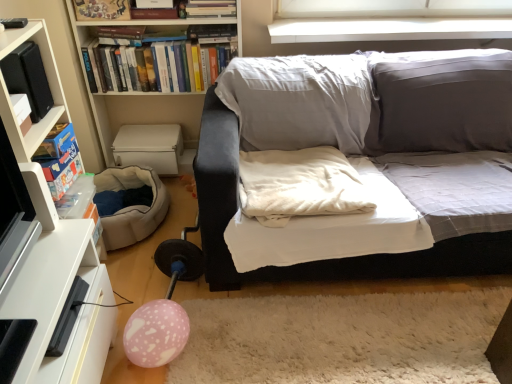
The height and width of the screenshot is (384, 512). I want to click on white glossy cabinet at left, the second cabinetry in the back-to-front sequence, so click(x=44, y=253).

Image resolution: width=512 pixels, height=384 pixels. Describe the element at coordinates (60, 159) in the screenshot. I see `blue cardboard game box at left, which is the 3th paperback book in top-to-bottom order` at that location.

Describe the element at coordinates (22, 111) in the screenshot. I see `white matte paperback book at upper left, the second paperback book viewed from the top` at that location.

Identify the location of white glossy cabinet at left, arranged as the first cabinetry when viewed from the front. The height and width of the screenshot is (384, 512). (44, 253).

Which is correct: white glossy tv stand at lower left is inside beige fabric bean bag at lower left, or outside of it?

white glossy tv stand at lower left is outside beige fabric bean bag at lower left.

Considering the sizes of objects white glossy tv stand at lower left and beige fabric bean bag at lower left in the image provided, who is smaller, white glossy tv stand at lower left or beige fabric bean bag at lower left?

beige fabric bean bag at lower left.

From the image's perspective, is white glossy tv stand at lower left located beneath beige fabric bean bag at lower left?

Yes.

From a real-world perspective, count 3rd paperback books upward from the white fabric couch at center and point to it. Please provide its 2D coordinates.

[(28, 78)]

Would you say white fabric couch at center is part of black matte speaker at left, positioned as the first paperback book in top-to-bottom order,'s contents?

Definitely not — white fabric couch at center is not inside black matte speaker at left, positioned as the first paperback book in top-to-bottom order.

From the image's perspective, would you say black matte speaker at left, the third paperback book in the bottom-to-top sequence, is shown under white fabric couch at center?

No, from the image's perspective, black matte speaker at left, the third paperback book in the bottom-to-top sequence, is not below white fabric couch at center.

Between point (40, 118) and point (463, 86), which one is positioned behind?

The point (463, 86) is farther.

Considering the sizes of objects white glossy cabinet at left, arranged as the first cabinetry when viewed from the front, and blue cardboard game box at left, marked as the 1th paperback book in a bottom-to-top arrangement, in the image provided, who is shorter, white glossy cabinet at left, arranged as the first cabinetry when viewed from the front, or blue cardboard game box at left, marked as the 1th paperback book in a bottom-to-top arrangement,?

Standing shorter between the two is blue cardboard game box at left, marked as the 1th paperback book in a bottom-to-top arrangement.

From a real-world perspective, which object stands above the other?

In real-world perspective, blue cardboard game box at left, which is the 3th paperback book in top-to-bottom order, is above.

Is white glossy cabinet at left, the second cabinetry in the back-to-front sequence, turned away from blue cardboard game box at left, which is the 3th paperback book in top-to-bottom order?

Absolutely, white glossy cabinet at left, the second cabinetry in the back-to-front sequence, is directed away from blue cardboard game box at left, which is the 3th paperback book in top-to-bottom order.

Considering the relative sizes of white glossy cabinet at left, arranged as the first cabinetry when viewed from the front, and blue cardboard game box at left, which is the 3th paperback book in top-to-bottom order, in the image provided, is white glossy cabinet at left, arranged as the first cabinetry when viewed from the front, smaller than blue cardboard game box at left, which is the 3th paperback book in top-to-bottom order,?

No.

Is pink matte balloon at lower left taller or shorter than white matte paperback book at upper left, the second paperback book from the bottom?

Clearly, pink matte balloon at lower left is taller compared to white matte paperback book at upper left, the second paperback book from the bottom.

In terms of width, does pink matte balloon at lower left look wider or thinner when compared to white matte paperback book at upper left, the second paperback book viewed from the top?

pink matte balloon at lower left is wider than white matte paperback book at upper left, the second paperback book viewed from the top.

Is pink matte balloon at lower left next to white matte paperback book at upper left, the second paperback book from the bottom?

There is a gap between pink matte balloon at lower left and white matte paperback book at upper left, the second paperback book from the bottom.

Does point (132, 325) lie behind point (17, 115)?

Yes, point (132, 325) is behind point (17, 115).

Looking at this image, is black matte speaker at left, positioned as the first paperback book in top-to-bottom order, next to matte wooden frame at upper left, which is the first book in front-to-back order, and touching it?

No, black matte speaker at left, positioned as the first paperback book in top-to-bottom order, is not beside matte wooden frame at upper left, which is the first book in front-to-back order.

From the black matte speaker at left, the third paperback book in the bottom-to-top sequence, count 1st books backward and point to it. Please provide its 2D coordinates.

[(102, 10)]

Considering the relative sizes of black matte speaker at left, positioned as the first paperback book in top-to-bottom order, and matte wooden frame at upper left, which is the first book in front-to-back order, in the image provided, is black matte speaker at left, positioned as the first paperback book in top-to-bottom order, wider than matte wooden frame at upper left, which is the first book in front-to-back order,?

Yes.

Would you say black matte speaker at left, the third paperback book in the bottom-to-top sequence, is outside matte wooden frame at upper left, which is the first book in front-to-back order?

Yes.

Can you confirm if white fluffy rug at lower center is taller than matte wooden frame at upper left, which is the 2th book from back to front?

Incorrect, the height of white fluffy rug at lower center is not larger of that of matte wooden frame at upper left, which is the 2th book from back to front.

Considering the relative sizes of white fluffy rug at lower center and matte wooden frame at upper left, which is the 2th book from back to front, in the image provided, is white fluffy rug at lower center smaller than matte wooden frame at upper left, which is the 2th book from back to front,?

Actually, white fluffy rug at lower center might be larger than matte wooden frame at upper left, which is the 2th book from back to front.

Which is behind, point (378, 297) or point (92, 4)?

The point (92, 4) is behind.

How much distance is there between white fluffy rug at lower center and matte wooden frame at upper left, which is the first book in front-to-back order?

white fluffy rug at lower center and matte wooden frame at upper left, which is the first book in front-to-back order, are 1.69 meters apart.

Can you confirm if white matte paperback book at upper left, the second paperback book from the bottom, is bigger than hardcover books at upper left, positioned as the first book in back-to-front order?

Incorrect, white matte paperback book at upper left, the second paperback book from the bottom, is not larger than hardcover books at upper left, positioned as the first book in back-to-front order.

From the image's perspective, is white matte paperback book at upper left, the second paperback book viewed from the top, on top of hardcover books at upper left, the second book positioned from the front?

Incorrect, from the image's perspective, white matte paperback book at upper left, the second paperback book viewed from the top, is lower than hardcover books at upper left, the second book positioned from the front.

Does white matte paperback book at upper left, the second paperback book viewed from the top, appear on the right side of hardcover books at upper left, positioned as the first book in back-to-front order?

In fact, white matte paperback book at upper left, the second paperback book viewed from the top, is to the left of hardcover books at upper left, positioned as the first book in back-to-front order.

Can you confirm if white matte paperback book at upper left, the second paperback book viewed from the top, is wider than hardcover books at upper left, positioned as the first book in back-to-front order?

Incorrect, the width of white matte paperback book at upper left, the second paperback book viewed from the top, does not surpass that of hardcover books at upper left, positioned as the first book in back-to-front order.

Where is `bean bag chair behind the white glossy tv stand at lower left`? bean bag chair behind the white glossy tv stand at lower left is located at coordinates (132, 205).

Identify the location of studio couch that appears below the black matte speaker at left, positioned as the first paperback book in top-to-bottom order (from the image's perspective). (336, 259).

Considering their positions, is black matte speaker at left, the third paperback book in the bottom-to-top sequence, positioned further to white soft pillow at center than beige fabric bean bag at lower left?

Based on the image, black matte speaker at left, the third paperback book in the bottom-to-top sequence, appears to be further to white soft pillow at center.

Consider the image. Looking at the image, which one is located further to blue cardboard game box at left, which is the 3th paperback book in top-to-bottom order, white fluffy rug at lower center or white fabric couch at center?

Among the two, white fluffy rug at lower center is located further to blue cardboard game box at left, which is the 3th paperback book in top-to-bottom order.

Based on their spatial positions, is white matte paperback book at upper left, the second paperback book from the bottom, or pink matte balloon at lower left closer to white glossy cabinet at left, arranged as the first cabinetry when viewed from the front?

pink matte balloon at lower left is closer to white glossy cabinet at left, arranged as the first cabinetry when viewed from the front.

Looking at the image, which one is located closer to white soft pillow at center, pink matte balloon at lower left or white fabric couch at center?

The object closer to white soft pillow at center is white fabric couch at center.

When comparing their distances from white fluffy rug at lower center, does white glossy cabinet at left, arranged as the first cabinetry when viewed from the front, or white glossy tv stand at lower left seem closer?

white glossy tv stand at lower left.

Considering their positions, is hardcover books at upper left, positioned as the first book in back-to-front order, positioned closer to pink matte balloon at lower left than matte wooden frame at upper left, which is the first book in front-to-back order?

hardcover books at upper left, positioned as the first book in back-to-front order, is positioned closer to the anchor pink matte balloon at lower left.

In the scene shown: Based on their spatial positions, is white glossy tv stand at lower left or hardcover books at upper left, the second book positioned from the front, further from white glossy cabinet at left, the second cabinetry in the back-to-front sequence?

The object further to white glossy cabinet at left, the second cabinetry in the back-to-front sequence, is hardcover books at upper left, the second book positioned from the front.

Estimate the real-world distances between objects in this image. Which object is further from white matte paperback book at upper left, the second paperback book viewed from the top, blue cardboard game box at left, marked as the 1th paperback book in a bottom-to-top arrangement, or white glossy cabinet at left, arranged as the first cabinetry when viewed from the front?

white glossy cabinet at left, arranged as the first cabinetry when viewed from the front.

You are a GUI agent. You are given a task and a screenshot of the screen. Output one action in this format:
    pyautogui.click(x=<x>, y=<y>)
    Task: Click on the balloon located between blue cardboard game box at left, which is the 3th paperback book in top-to-bottom order, and white soft pillow at center in the left-right direction
    This screenshot has width=512, height=384.
    Given the screenshot: What is the action you would take?
    click(156, 333)

Where is `table between hardcover books at upper left, the second book positioned from the front, and white fluffy rug at lower center, in the vertical direction`? The image size is (512, 384). table between hardcover books at upper left, the second book positioned from the front, and white fluffy rug at lower center, in the vertical direction is located at coordinates (62, 306).

Locate an element on the screen. plain between white plastic bookshelf at upper left, the 1th cabinetry in the back-to-front sequence, and white fabric couch at center from left to right is located at coordinates (342, 338).

You are a GUI agent. You are given a task and a screenshot of the screen. Output one action in this format:
    pyautogui.click(x=<x>, y=<y>)
    Task: Click on the pillow between matte wooden frame at upper left, which is the first book in front-to-back order, and white glossy tv stand at lower left, in the vertical direction
    The height and width of the screenshot is (384, 512).
    Given the screenshot: What is the action you would take?
    pyautogui.click(x=298, y=185)